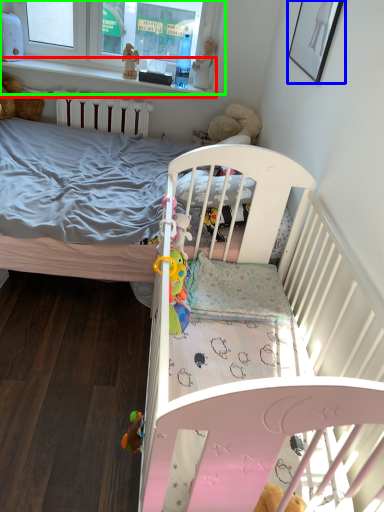
Question: Which object is positioned closest to balustrade (highlighted by a red box)? Select from picture frame (highlighted by a blue box) and window frame (highlighted by a green box).

Choices:
 (A) picture frame
 (B) window frame

Answer: (B)